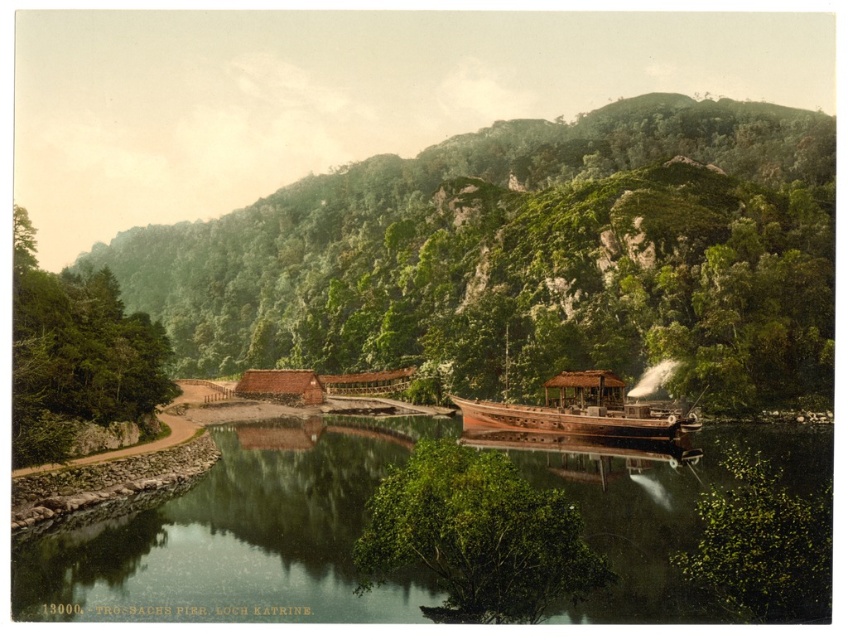
Looking at this image, you are standing at the point marked as point (76,355) in the image. Looking around, you see green leafy trees at left. Which direction should you walk to reach the wooden boat docked on the right side of the river?

You should walk to the right because the wooden boat docked on the right side of the river is located to the right of your current position at point (76,355), which is among the green leafy trees at left.

You are standing at the point with coordinates 0.5, 0.5 in the image. You want to reach the green smooth water at center. Which direction should you move in to get there?

The green smooth water at center is located at coordinates (x=240, y=536). Since your current position is at (x=424, y=320), you should move towards the northeast direction to reach it.

You are a hiker who wants to travel from the wooden steamboat at right to the green leafy mountain at center. Given that your average walking speed is 5 km per hour, how many minutes would it take you to reach the mountain?

The distance between the green leafy mountain at center and the wooden steamboat at right is 71.28 meters. Converting this distance to kilometers gives 0.07128 km. Dividing this by your walking speed of 5 km per hour yields 0.014256 hours. Multiplying by 60 minutes gives approximately 0.855 minutes, so it would take roughly 0.9 minutes to reach the mountain.